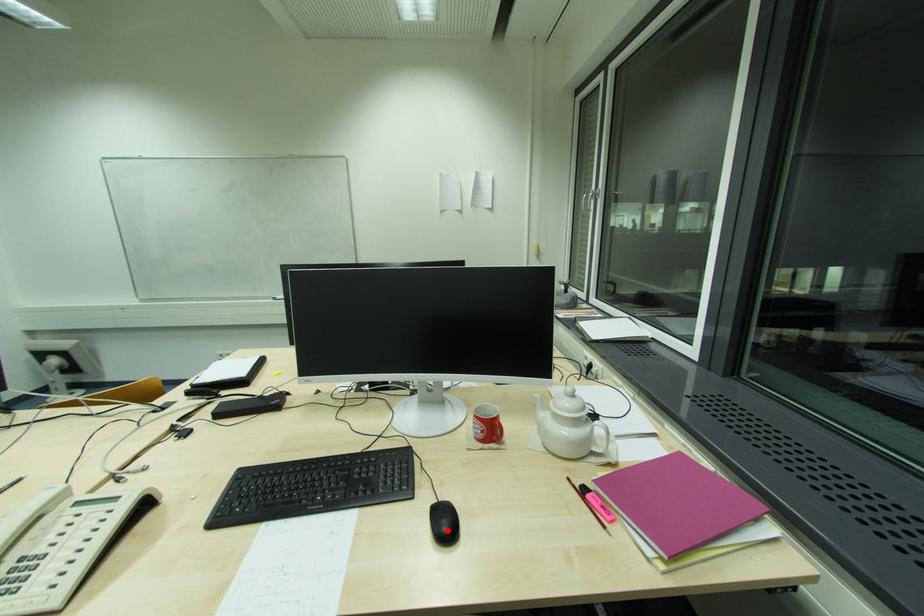
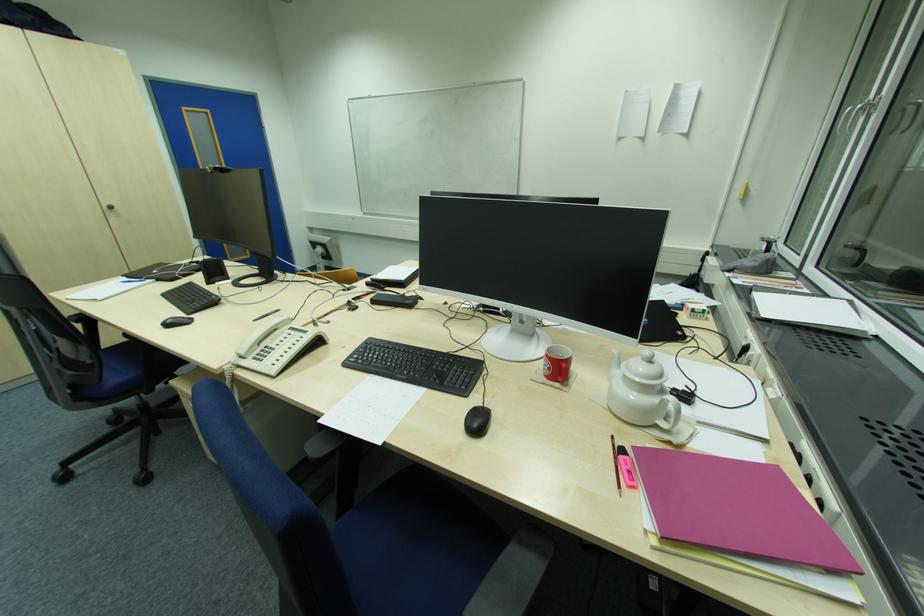
In the second image, find the point that corresponds to the highlighted location in the first image.

(478, 426)